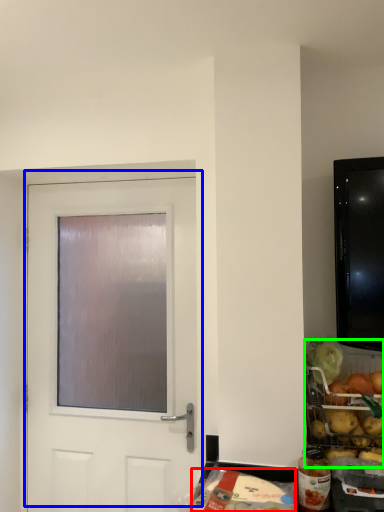
Question: Which object is the closest to the food (highlighted by a red box)? Choose among these: door (highlighted by a blue box) or food (highlighted by a green box).

Choices:
 (A) door
 (B) food

Answer: (B)